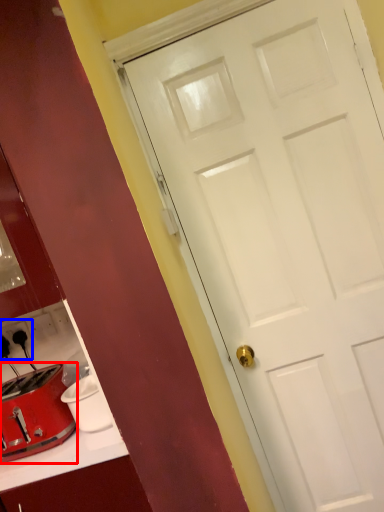
Question: Which of the following is the closest to the observer, toaster (highlighted by a red box) or electric outlet (highlighted by a blue box)?

Choices:
 (A) toaster
 (B) electric outlet

Answer: (A)